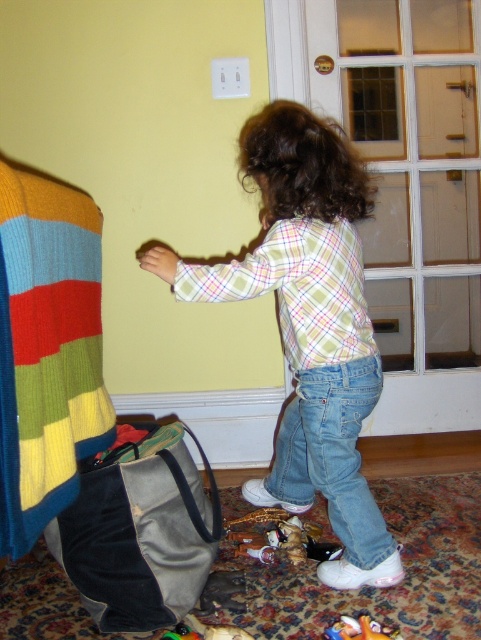
Question: Is plaid shirt at center below plush yellow toy at lower center?

Choices:
 (A) no
 (B) yes

Answer: (A)

Question: Does plush yellow toy at lower center appear over rubberized green toy at lower center?

Choices:
 (A) no
 (B) yes

Answer: (B)

Question: Estimate the real-world distances between objects in this image. Which object is farther from the plush yellow toy at lower center?

Choices:
 (A) plush fabric stuffed animal at lower center
 (B) plaid shirt at center

Answer: (B)

Question: Is plush fabric stuffed animal at lower center behind plush yellow toy at lower center?

Choices:
 (A) no
 (B) yes

Answer: (B)

Question: Which point is closer to the camera?

Choices:
 (A) plush fabric stuffed animal at lower center
 (B) plaid shirt at center
 (C) multicolored knitted blanket at left

Answer: (C)

Question: Which point appears closest to the camera in this image?

Choices:
 (A) [189, 628]
 (B) [37, 440]
 (C) [359, 278]
 (D) [264, 560]

Answer: (B)